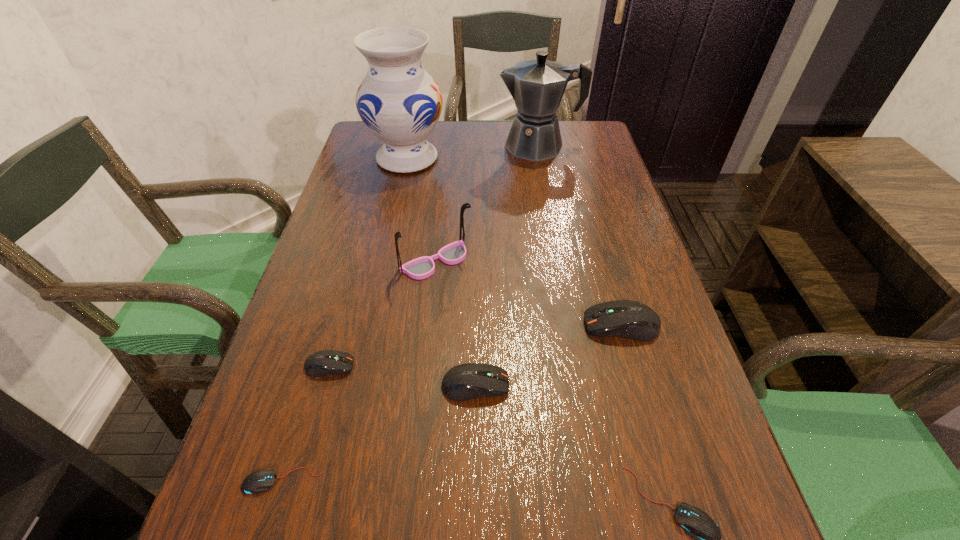
Image resolution: width=960 pixels, height=540 pixels. Identify the location of object that is at the far right corner. (537, 86).

This screenshot has width=960, height=540. Identify the location of vacant space at the far edge of the desktop. (451, 152).

Find the location of a particular element. vacant space at the left edge of the desktop is located at coordinates (376, 192).

Image resolution: width=960 pixels, height=540 pixels. In order to click on vacant space at the right edge of the desktop in this screenshot , I will do `click(576, 232)`.

At what (x,y) coordinates should I click in order to perform the action: click on empty space between the pink spectacles and the tallest mouse. Please return your answer as a coordinate pair (x, y). The width and height of the screenshot is (960, 540). Looking at the image, I should click on (529, 293).

Image resolution: width=960 pixels, height=540 pixels. I want to click on vacant region between the spectacles and the fourth shortest object, so click(456, 323).

Identify the location of free spot between the fourth shortest object and the leftmost dark computer equipment. (402, 375).

What are the coordinates of `vacant region between the coffeepot and the shortest object` in the screenshot? It's located at (411, 313).

Where is `free area in between the smaller black mouse and the fifth tallest object`? The height and width of the screenshot is (540, 960). free area in between the smaller black mouse and the fifth tallest object is located at coordinates (379, 433).

Identify the location of vacant space that's between the second dark computer equipment from left to right and the third shortest mouse. (402, 375).